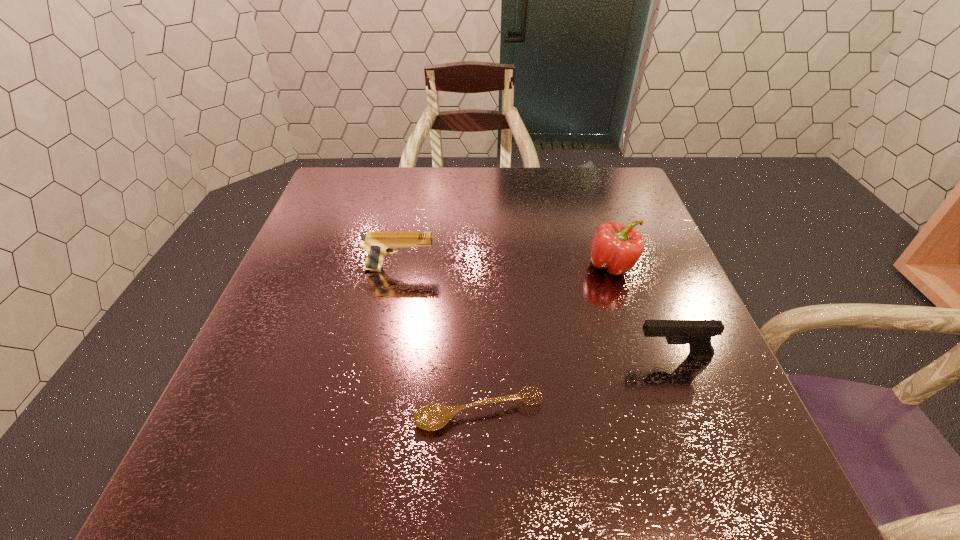
Find the location of a particular element. vacant space that's between the farther pistol and the nearest object is located at coordinates (440, 341).

In order to click on free spot between the nearer pistol and the nearest object in this screenshot , I will do pyautogui.click(x=575, y=384).

The image size is (960, 540). What are the coordinates of `object that is the second nearest to the pepper` in the screenshot? It's located at (434, 416).

Image resolution: width=960 pixels, height=540 pixels. What are the coordinates of `the second closest object to the farther pistol` in the screenshot? It's located at (616, 248).

The height and width of the screenshot is (540, 960). Find the location of `vacant space that satisfies the following two spatial constraints: 1. on the front-facing side of the nearer pistol; 2. on the front side of the shortest object`. vacant space that satisfies the following two spatial constraints: 1. on the front-facing side of the nearer pistol; 2. on the front side of the shortest object is located at coordinates (694, 413).

Image resolution: width=960 pixels, height=540 pixels. What are the coordinates of `free space that satisfies the following two spatial constraints: 1. on the front side of the pepper; 2. at the barrel of the left pistol` in the screenshot? It's located at (612, 269).

Locate an element on the screen. The height and width of the screenshot is (540, 960). free space that satisfies the following two spatial constraints: 1. at the barrel of the shortest object; 2. on the left side of the farther pistol is located at coordinates (372, 413).

Find the location of a particular element. The height and width of the screenshot is (540, 960). blank space that satisfies the following two spatial constraints: 1. at the barrel of the left pistol; 2. on the back side of the nearest object is located at coordinates (372, 413).

Locate an element on the screen. Image resolution: width=960 pixels, height=540 pixels. free space that satisfies the following two spatial constraints: 1. on the front-facing side of the right pistol; 2. on the front side of the shortest object is located at coordinates (694, 413).

Identify the location of vacant area that satisfies the following two spatial constraints: 1. at the barrel of the nearest object; 2. on the right side of the farther pistol. The width and height of the screenshot is (960, 540). (x=372, y=413).